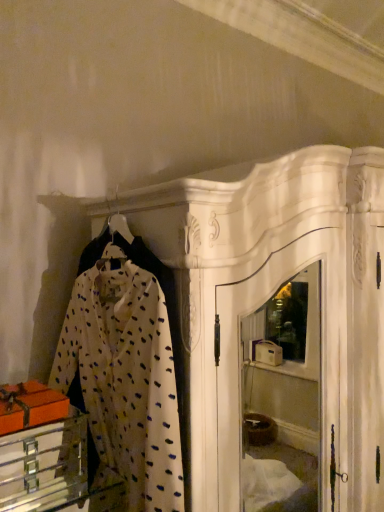
Question: Considering the positions of metallic silver drawer at lower left and white dotted fabric at center in the image, is metallic silver drawer at lower left taller or shorter than white dotted fabric at center?

Choices:
 (A) short
 (B) tall

Answer: (A)

Question: In terms of width, does metallic silver drawer at lower left look wider or thinner when compared to white dotted fabric at center?

Choices:
 (A) thin
 (B) wide

Answer: (B)

Question: From the image's perspective, is metallic silver drawer at lower left located above or below white dotted fabric at center?

Choices:
 (A) above
 (B) below

Answer: (B)

Question: Relative to metallic silver drawer at lower left, is white dotted fabric at center in front or behind?

Choices:
 (A) behind
 (B) front

Answer: (B)

Question: In terms of width, does white dotted fabric at center look wider or thinner when compared to metallic silver drawer at lower left?

Choices:
 (A) wide
 (B) thin

Answer: (B)

Question: Visually, is white dotted fabric at center positioned to the left or to the right of metallic silver drawer at lower left?

Choices:
 (A) left
 (B) right

Answer: (B)

Question: Is white dotted fabric at center taller or shorter than metallic silver drawer at lower left?

Choices:
 (A) short
 (B) tall

Answer: (B)